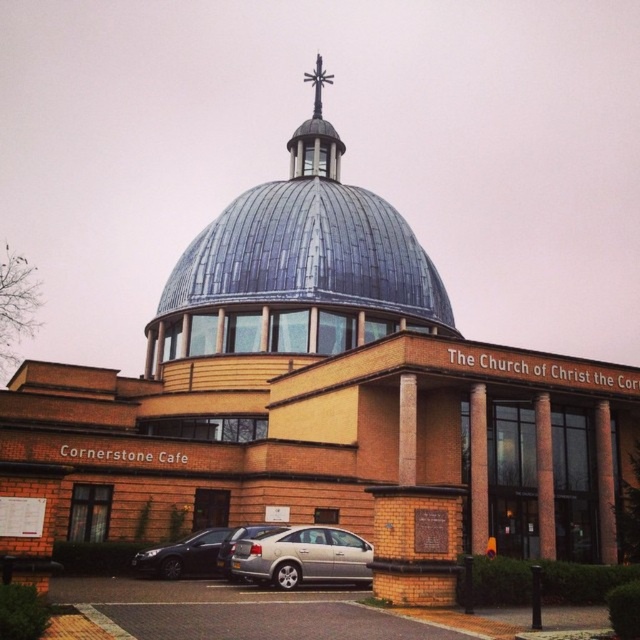
Question: Which object appears farthest from the camera in this image?

Choices:
 (A) silver metallic car at lower center
 (B) polished metal cross at upper center
 (C) metallic blue dome at center
 (D) shiny black sedan at lower left

Answer: (B)

Question: Which object appears closest to the camera in this image?

Choices:
 (A) polished metal cross at upper center
 (B) shiny black sedan at lower left
 (C) silver metallic sedan at center
 (D) metallic blue dome at center

Answer: (C)

Question: Can you confirm if metallic blue dome at center is bigger than shiny black sedan at lower left?

Choices:
 (A) no
 (B) yes

Answer: (B)

Question: Which point is farther to the camera?

Choices:
 (A) silver metallic car at lower center
 (B) silver metallic sedan at center

Answer: (B)

Question: Is metallic blue dome at center wider than silver metallic sedan at center?

Choices:
 (A) yes
 (B) no

Answer: (A)

Question: Is metallic blue dome at center above shiny black sedan at lower left?

Choices:
 (A) yes
 (B) no

Answer: (A)